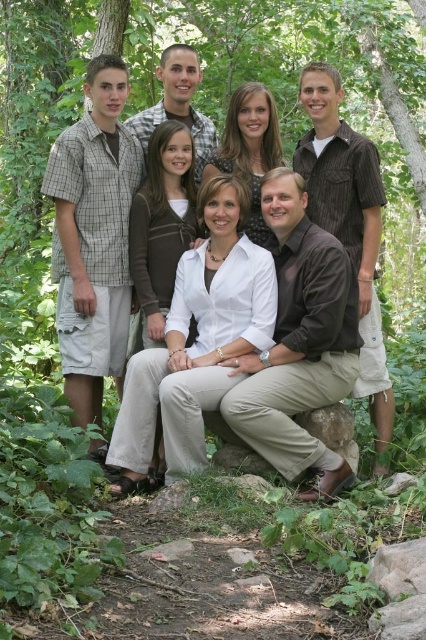
Based on the photo, which is more to the left, matte white shirt at center or brown rough stone at lower center?

From the viewer's perspective, brown rough stone at lower center appears more on the left side.

Which is below, matte white shirt at center or brown rough stone at lower center?

brown rough stone at lower center

Does point (371, 273) come behind point (344, 433)?

That is True.

Locate an element on the screen. This screenshot has width=426, height=640. matte white shirt at center is located at coordinates (348, 224).